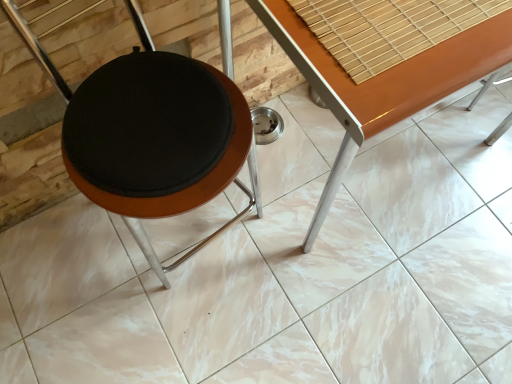
Where is `free space in front of matte black stool at center`? Image resolution: width=512 pixels, height=384 pixels. free space in front of matte black stool at center is located at coordinates 176,336.